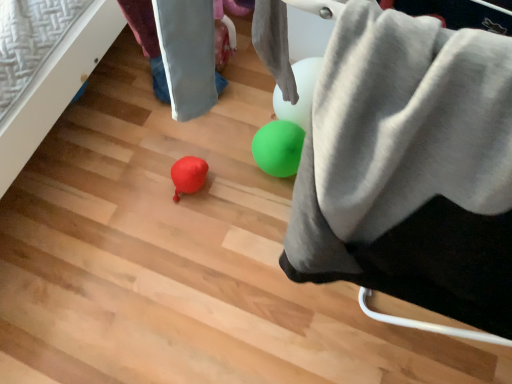
Locate an element on the screen. Image resolution: width=512 pixels, height=384 pixels. velvet gray bean bag chair at center is located at coordinates (410, 167).

Image resolution: width=512 pixels, height=384 pixels. What do you see at coordinates (410, 167) in the screenshot? I see `velvet gray bean bag chair at center` at bounding box center [410, 167].

This screenshot has height=384, width=512. I want to click on velvet gray bean bag chair at center, so click(x=410, y=167).